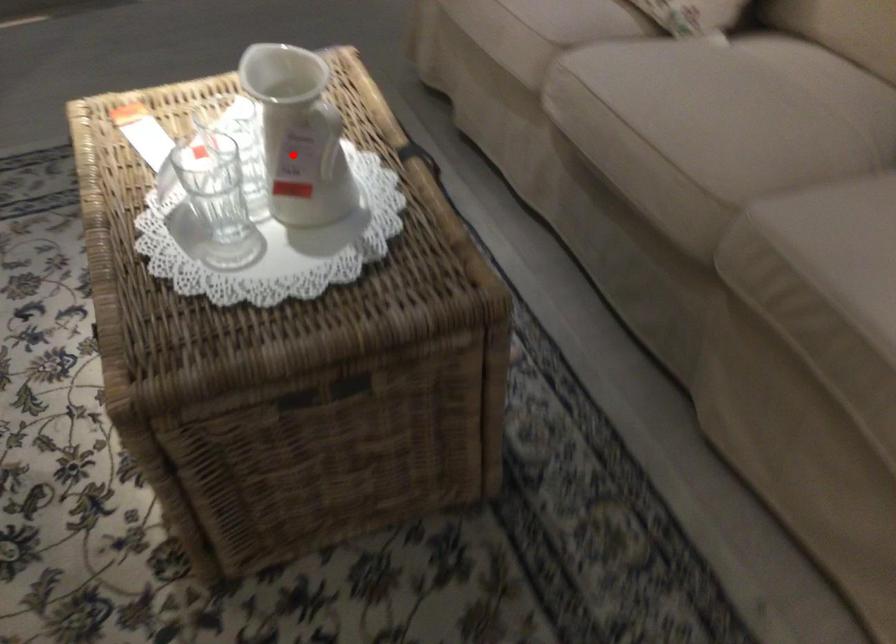
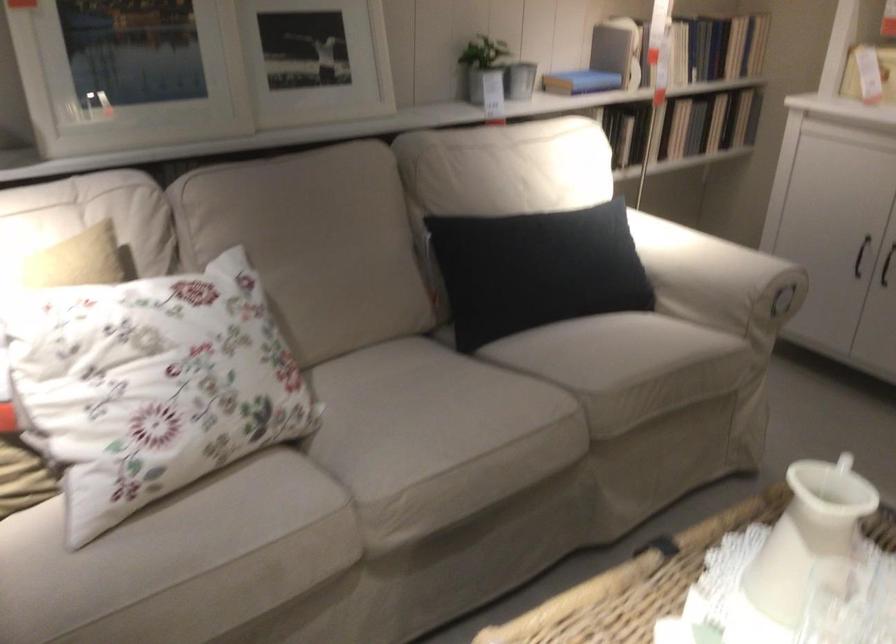
Where in the second image is the point corresponding to the highlighted location from the first image?

(803, 552)